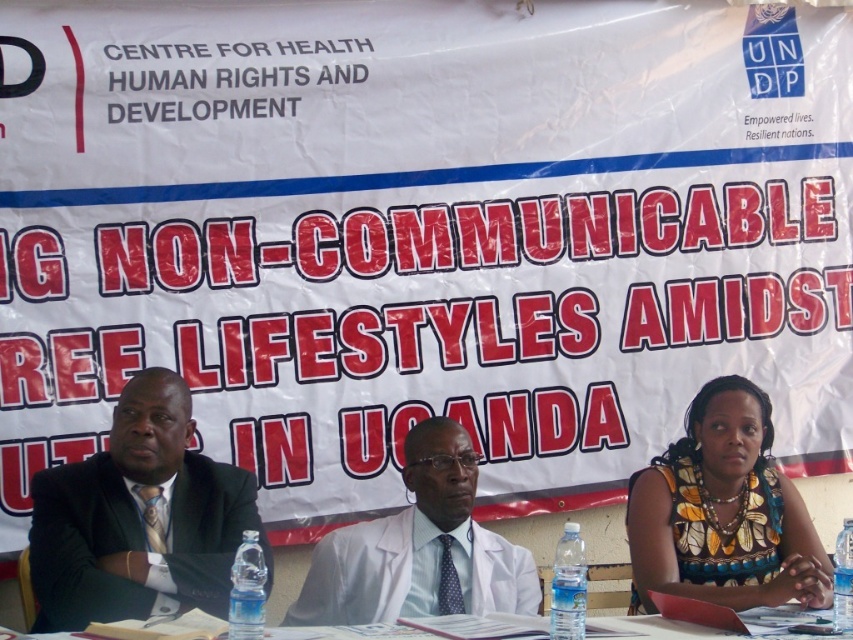
Consider the image. Does white lab coat at center have a greater width compared to clear plastic water bottles at lower center?

No.

Who is more forward, [457,484] or [659,636]?

Point [659,636] is in front.

Where is `white lab coat at center`? This screenshot has width=853, height=640. white lab coat at center is located at coordinates (419, 548).

Who is taller, floral fabric dress at lower right or white lab coat at center?

With more height is floral fabric dress at lower right.

Based on the photo, measure the distance between point (763, 532) and camera.

Point (763, 532) and camera are 6.15 meters apart from each other.

The width and height of the screenshot is (853, 640). I want to click on floral fabric dress at lower right, so click(723, 512).

Which of these two, black suit at left or clear plastic water bottles at lower center, stands shorter?

clear plastic water bottles at lower center is shorter.

Is black suit at left wider than clear plastic water bottles at lower center?

No.

You are a GUI agent. You are given a task and a screenshot of the screen. Output one action in this format:
    pyautogui.click(x=<x>, y=<y>)
    Task: Click on the black suit at left
    This screenshot has width=853, height=640.
    Given the screenshot: What is the action you would take?
    pyautogui.click(x=138, y=518)